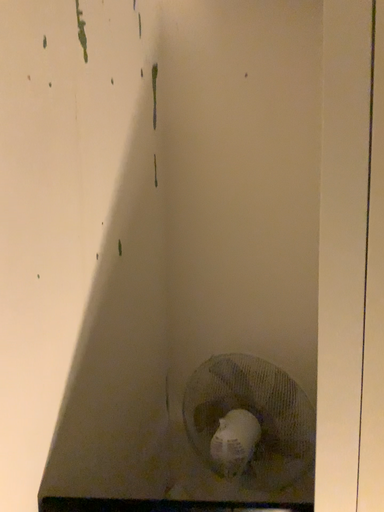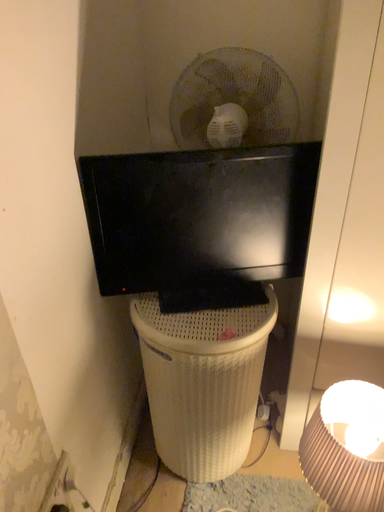
Question: How did the camera likely rotate when shooting the video?

Choices:
 (A) rotated upward
 (B) rotated downward

Answer: (B)